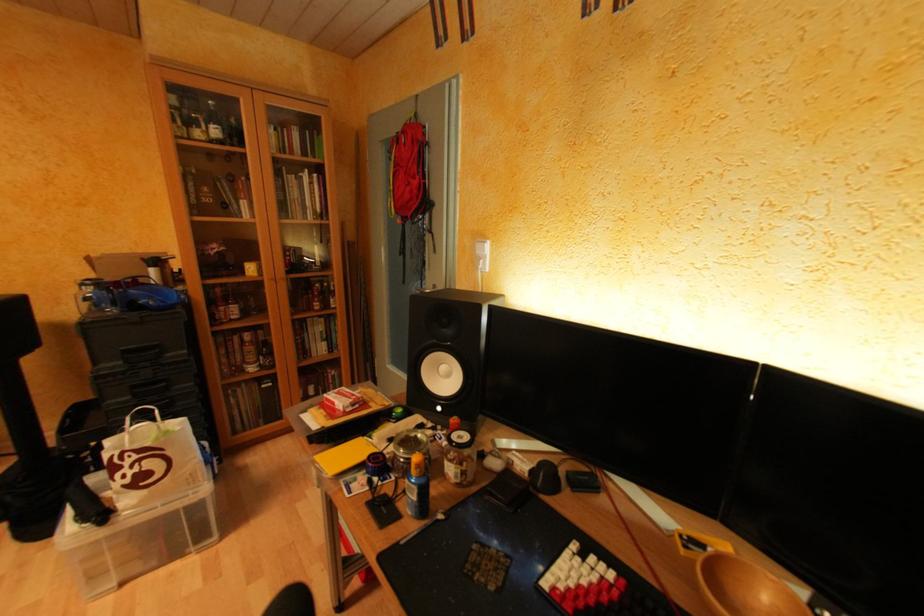
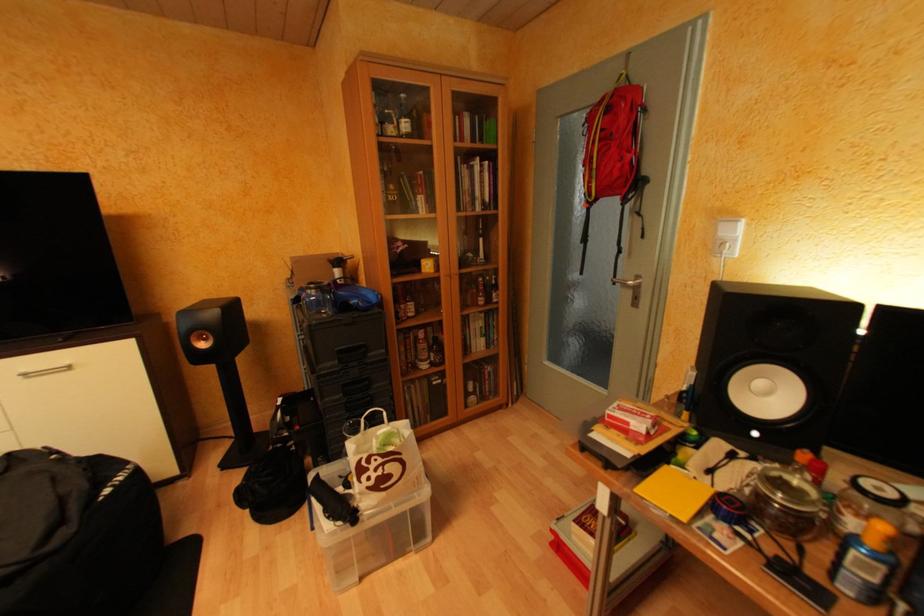
Question: In a continuous first-person perspective shot, in which direction is the camera moving?

Choices:
 (A) Left
 (B) Right
 (C) Forward
 (D) Backward

Answer: (A)